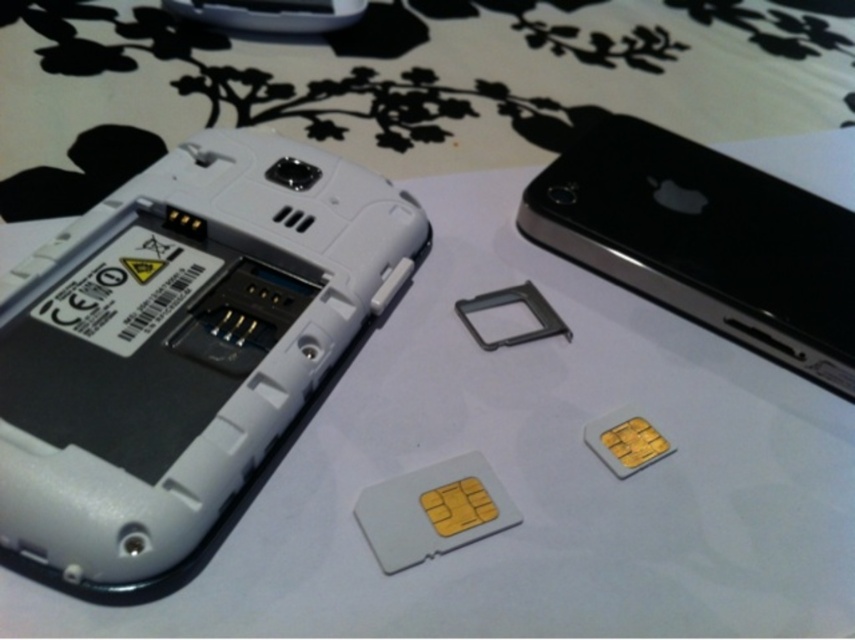
Does white plastic smartphone at upper left have a smaller size compared to black glossy smartphone at upper right?

No.

This screenshot has width=855, height=640. I want to click on white plastic smartphone at upper left, so click(181, 353).